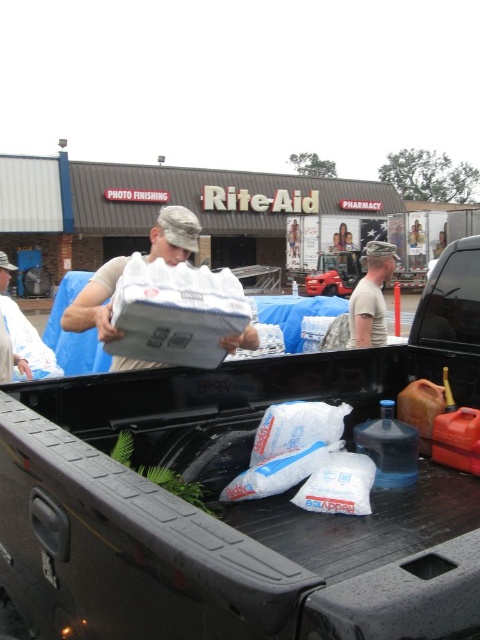
You are organizing items in the truck bed and need to know which object takes up more space. Which is larger between the white plastic bag at center and the camouflage uniform at center?

The camouflage uniform at center is larger than the white plastic bag at center.

You are organizing items in the truck bed and need to know if the white plastic bag at center can fit sideways into the black rubber truck bed at center. Can it fit based on their widths?

The black rubber truck bed at center is wider than the white plastic bag at center, so the white plastic bag at center can fit sideways within the black rubber truck bed at center.

Based on the scene description, where is the white plastic bag at center located in relation to the pickup truck bed?

The white plastic bag at center is located at point (20, 337) in the pickup truck bed.